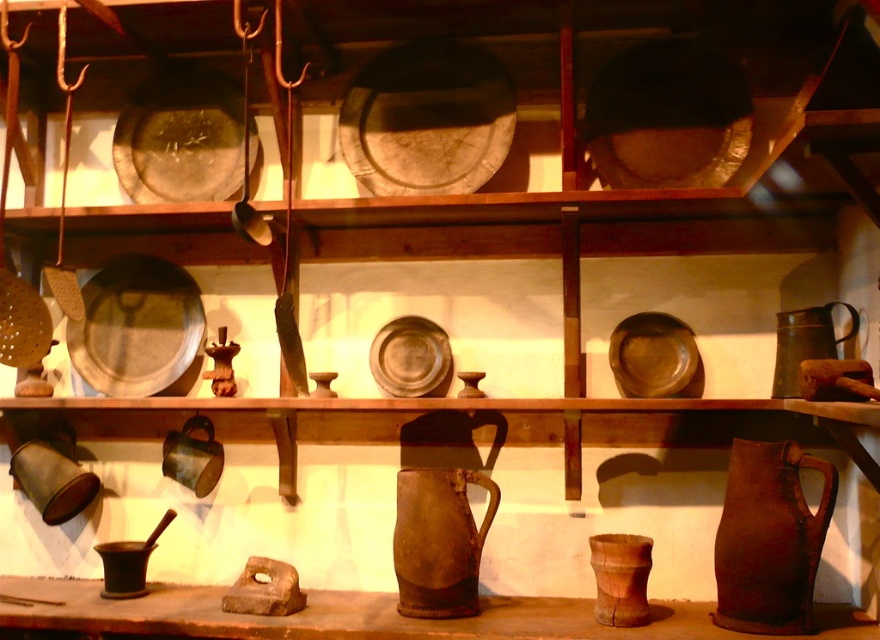
Which is more to the right, brown wooden cup at lower center or green matte jug at right?

From the viewer's perspective, green matte jug at right appears more on the right side.

Looking at this image, is brown wooden cup at lower center taller than green matte jug at right?

Incorrect, brown wooden cup at lower center's height is not larger of green matte jug at right's.

The image size is (880, 640). Describe the element at coordinates (620, 577) in the screenshot. I see `brown wooden cup at lower center` at that location.

You are a GUI agent. You are given a task and a screenshot of the screen. Output one action in this format:
    pyautogui.click(x=<x>, y=<y>)
    Task: Click on the brown wooden cup at lower center
    The width and height of the screenshot is (880, 640).
    Given the screenshot: What is the action you would take?
    pyautogui.click(x=620, y=577)